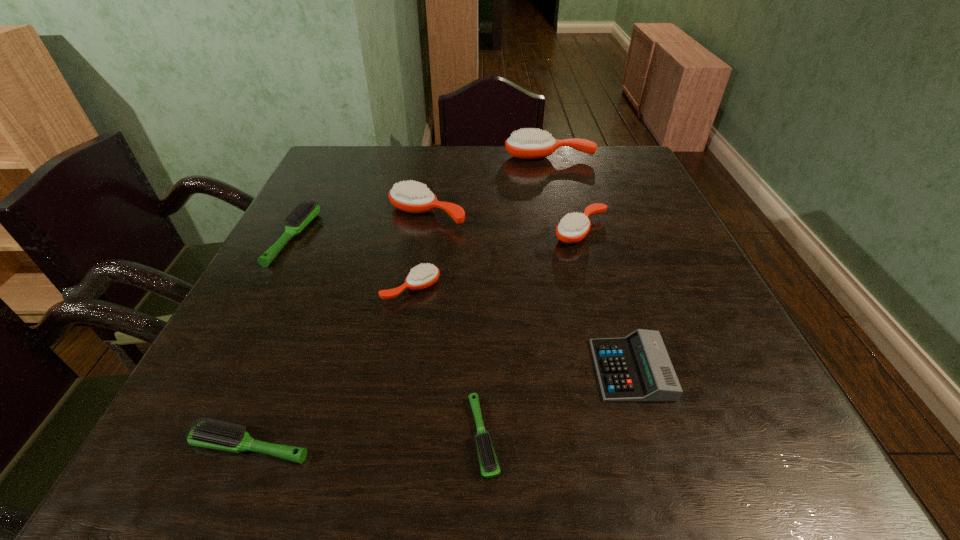
Find the location of a particular element. This screenshot has height=540, width=960. the biggest orange hairbrush is located at coordinates (531, 143).

The width and height of the screenshot is (960, 540). What are the coordinates of `the farthest object` in the screenshot? It's located at (531, 143).

Identify the location of the second biggest orange hairbrush. The image size is (960, 540). (410, 196).

The height and width of the screenshot is (540, 960). I want to click on the sixth shortest hairbrush, so click(410, 196).

Locate an element on the screen. The image size is (960, 540). the fifth shortest hairbrush is located at coordinates tap(572, 228).

Locate an element on the screen. The image size is (960, 540). the second smallest orange hairbrush is located at coordinates (572, 228).

Locate an element on the screen. Image resolution: width=960 pixels, height=540 pixels. the farthest light hairbrush is located at coordinates (305, 212).

Locate an element on the screen. This screenshot has height=540, width=960. the fourth nearest object is located at coordinates (423, 276).

Image resolution: width=960 pixels, height=540 pixels. I want to click on the smallest orange hairbrush, so click(423, 276).

At what (x,y) coordinates should I click in order to perform the action: click on calculator. Please return your answer as a coordinate pair (x, y). Looking at the image, I should click on (637, 368).